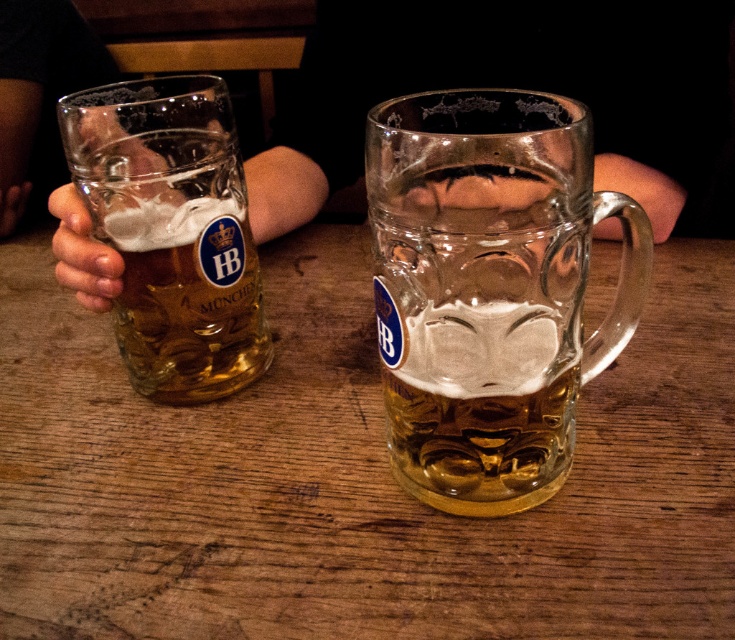
You are a bartender who needs to place a new drink order on the wooden table at center. However, there is already a translucent glass mug at left on it. Where should you place the new drink to avoid knocking over the existing mug?

You should place the new drink on the wooden table at center away from the translucent glass mug at left since the table is in front of the mug, indicating there is space available.

You are at a German beer hall and want to place a new beer mug on the table. The new mug is the same size as the clear glass mug at center. Can the wooden table at center accommodate the new mug without it hanging over the edge?

The wooden table at center has a larger size compared to clear glass mug at center, so yes, the new mug can be placed on the wooden table at center without hanging over the edge.